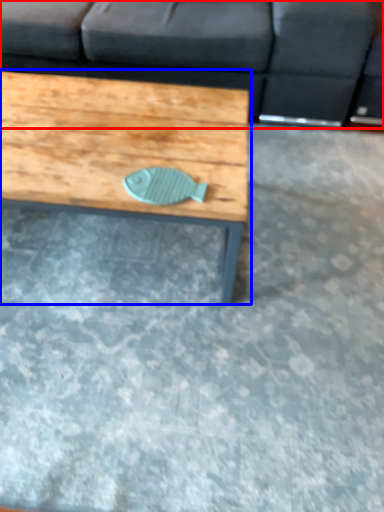
Question: Which point is further to the camera, studio couch (highlighted by a red box) or coffee table (highlighted by a blue box)?

Choices:
 (A) studio couch
 (B) coffee table

Answer: (A)